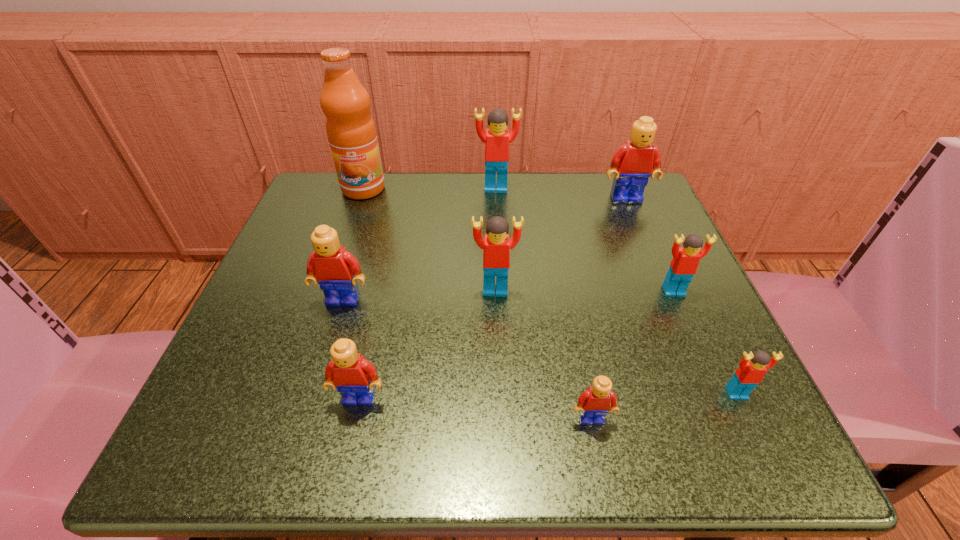
In order to click on the tallest object in this screenshot , I will do `click(351, 132)`.

The width and height of the screenshot is (960, 540). Identify the location of the farthest red Lego. (497, 138).

Image resolution: width=960 pixels, height=540 pixels. I want to click on the farthest yellow Lego, so click(638, 159).

This screenshot has height=540, width=960. I want to click on the biggest yellow Lego, so click(x=638, y=159).

Identify the location of the second biggest red Lego. The image size is (960, 540). (496, 255).

In order to click on the second farthest yellow Lego in this screenshot , I will do tap(336, 270).

Find the location of a particular element. This screenshot has width=960, height=540. the second smallest red Lego is located at coordinates (684, 264).

This screenshot has width=960, height=540. I want to click on the third farthest yellow Lego, so click(354, 377).

At what (x,y) coordinates should I click in order to perform the action: click on the smallest red Lego. Please return your answer as a coordinate pair (x, y). Looking at the image, I should click on (752, 367).

Locate an element on the screen. The image size is (960, 540). the nearest yellow Lego is located at coordinates (594, 404).